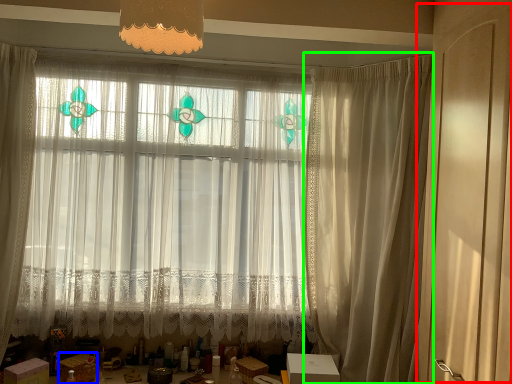
Question: Which object is the farthest from screen door (highlighted by a red box)? Choose among these: cardboard box (highlighted by a blue box) or curtain (highlighted by a green box).

Choices:
 (A) cardboard box
 (B) curtain

Answer: (A)